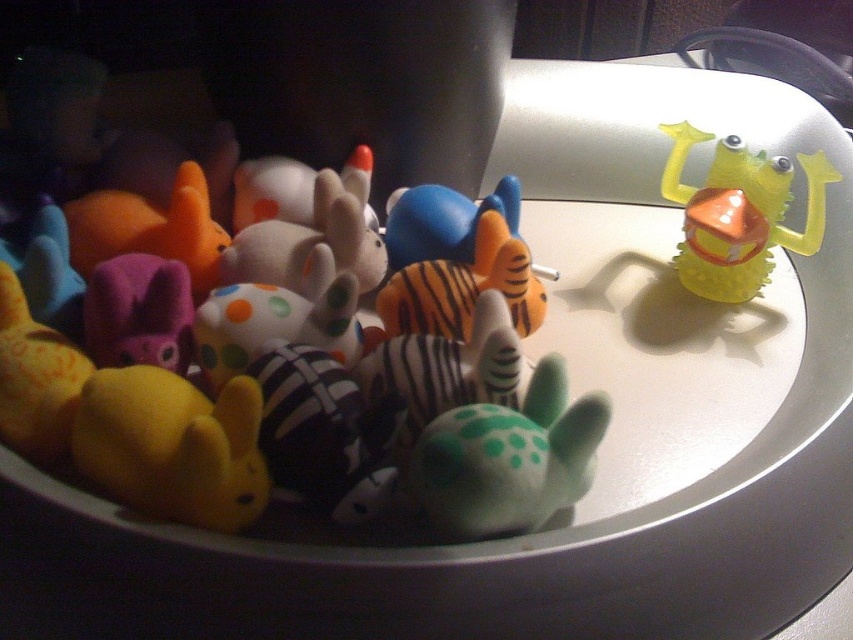
Question: Is yellow matte rabbit at lower left above rubber duck at upper right?

Choices:
 (A) yes
 (B) no

Answer: (B)

Question: Which point is farther to the camera?

Choices:
 (A) blue matte plush toy at center
 (B) green matte turtle at center

Answer: (A)

Question: Which point is closer to the camera?

Choices:
 (A) (80, 384)
 (B) (125, 435)

Answer: (B)

Question: Can you confirm if yellow matte rabbit at lower left is bigger than matte purple plush at left?

Choices:
 (A) yes
 (B) no

Answer: (B)

Question: Is matte rubber frog at upper right above yellow matte rabbit at lower left?

Choices:
 (A) no
 (B) yes

Answer: (B)

Question: Among these points, which one is farthest from the camera?

Choices:
 (A) (743, 202)
 (B) (439, 237)

Answer: (B)